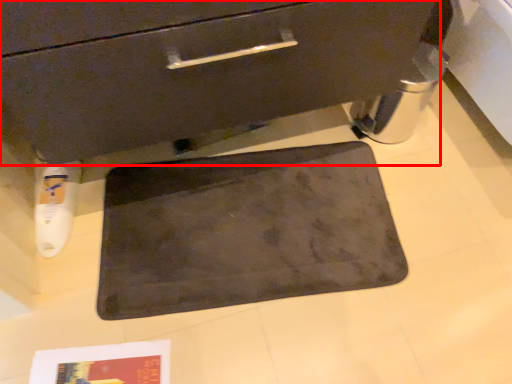
Question: Observing the image, what is the correct spatial positioning of drawer (annotated by the red box) in reference to bath mat?

Choices:
 (A) right
 (B) left

Answer: (B)